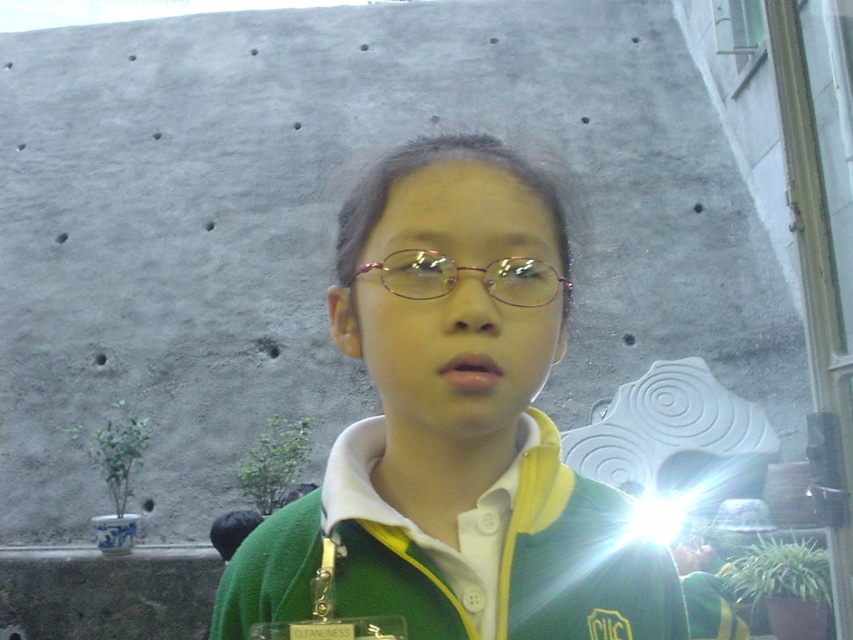
You are a fashion designer observing the image. You need to decide which item to place in a display case that can only accommodate items narrower than 30 cm. Based on the green matte sweater at center and the pink metallic glasses at center, which item should you choose?

The green matte sweater at center has a width less than the pink metallic glasses at center, so the green matte sweater at center should be chosen for the display case since it is narrower.